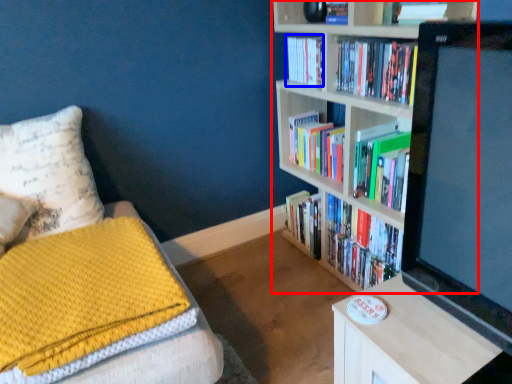
Question: Which point is closer to the camera, bookcase (highlighted by a red box) or book (highlighted by a blue box)?

Choices:
 (A) bookcase
 (B) book

Answer: (A)